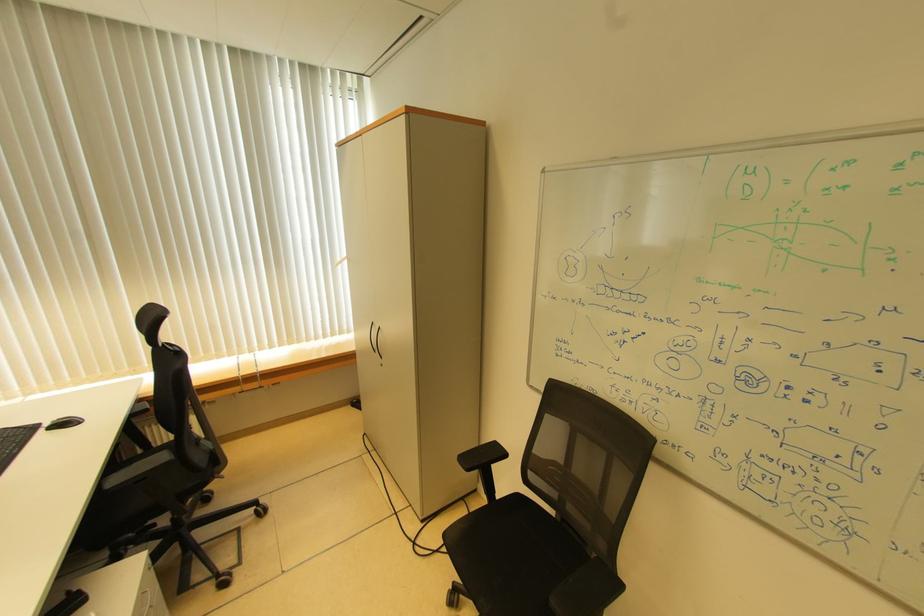
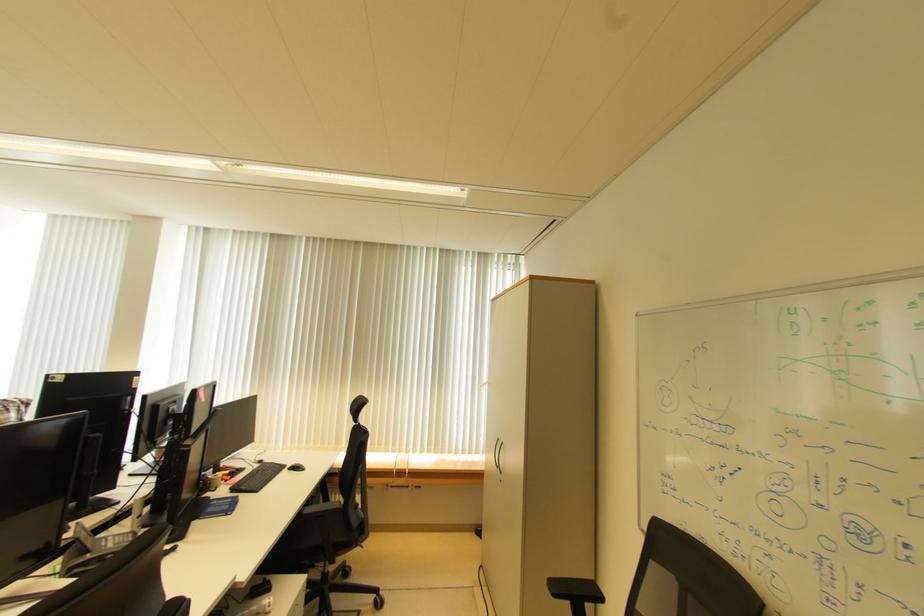
Where in the second image is the point corresponding to the point at 51,432 from the first image?

(295, 471)